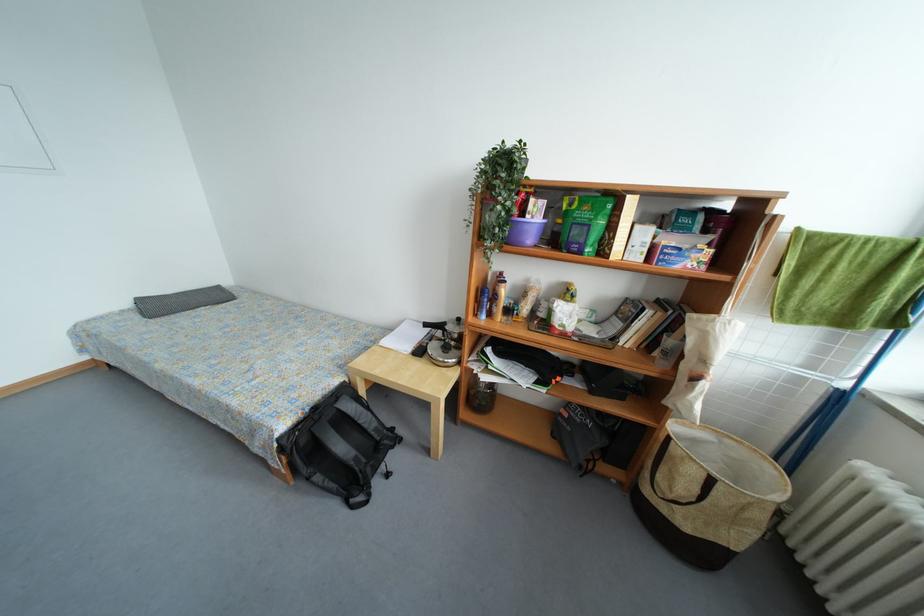
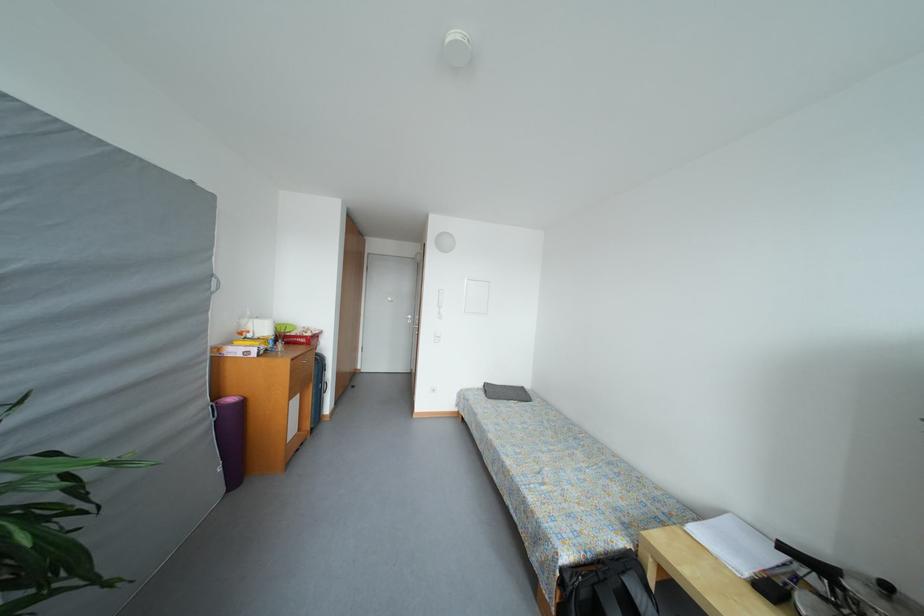
The point at (466, 323) is marked in the first image. Where is the corresponding point in the second image?

(893, 591)